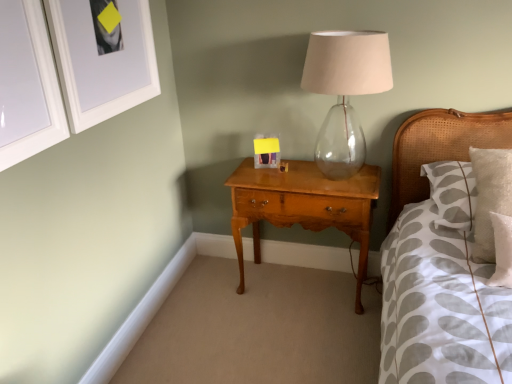
Locate an element on the screen. empty space that is ontop of shiny brown wood nightstand at center (from a real-world perspective) is located at coordinates (315, 178).